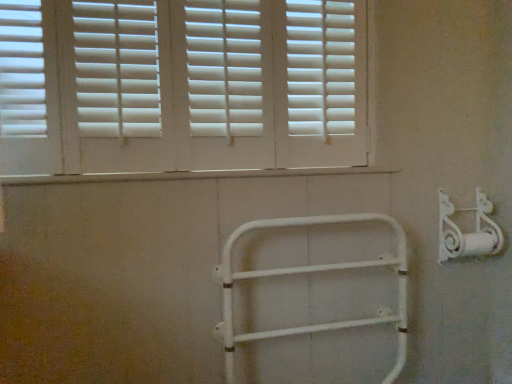
Find the location of a particular element. white matte shutters at upper center is located at coordinates (182, 86).

Consider the image. Can you confirm if white matte metal rail at center is smaller than white matte shutters at upper center?

Correct, white matte metal rail at center occupies less space than white matte shutters at upper center.

In the scene shown: Measure the distance between white matte metal rail at center and white matte shutters at upper center.

white matte metal rail at center and white matte shutters at upper center are 17.34 inches apart from each other.

From the image's perspective, is white matte metal rail at center on white matte shutters at upper center?

No.

In the scene shown: Is white matte shutters at upper center facing away from white matte bracket at right?

white matte shutters at upper center is not turned away from white matte bracket at right.

Is white matte shutters at upper center completely or partially outside of white matte bracket at right?

Yes, white matte shutters at upper center is located beyond the bounds of white matte bracket at right.

Which of these two, white matte shutters at upper center or white matte bracket at right, is bigger?

With larger size is white matte shutters at upper center.

From the image's perspective, which is below, white matte shutters at upper center or white matte bracket at right?

white matte bracket at right is shown below in the image.

Considering the positions of points (381, 319) and (503, 241), is point (381, 319) farther from camera compared to point (503, 241)?

That is False.

From the image's perspective, which one is positioned lower, white matte metal rail at center or white matte bracket at right?

white matte metal rail at center appears lower in the image.

From a real-world perspective, does white matte metal rail at center sit lower than white matte bracket at right?

Indeed, from a real-world perspective, white matte metal rail at center is positioned beneath white matte bracket at right.

Are white matte metal rail at center and white matte bracket at right making contact?

No.

From the picture: From a real-world perspective, is white matte bracket at right above or below white matte shutters at upper center?

In terms of real-world spatial position, white matte bracket at right is below white matte shutters at upper center.

Can you tell me how much white matte bracket at right and white matte shutters at upper center differ in facing direction?

0.132 degrees separate the facing orientations of white matte bracket at right and white matte shutters at upper center.

Could you tell me if white matte bracket at right is facing white matte shutters at upper center?

No, white matte bracket at right is not oriented towards white matte shutters at upper center.

From the image's perspective, is white matte bracket at right on top of white matte shutters at upper center?

Incorrect, from the image's perspective, white matte bracket at right is lower than white matte shutters at upper center.

Is white matte bracket at right aimed at white matte metal rail at center?

No, white matte bracket at right does not turn towards white matte metal rail at center.

Considering the positions of point (460, 254) and point (335, 219), is point (460, 254) closer or farther from the camera than point (335, 219)?

Clearly, point (460, 254) is more distant from the camera than point (335, 219).

Is there a large distance between white matte bracket at right and white matte metal rail at center?

No, white matte bracket at right is not far away from white matte metal rail at center.

Is white matte shutters at upper center far away from white matte metal rail at center?

That's not correct — white matte shutters at upper center is a little close to white matte metal rail at center.

Is white matte shutters at upper center spatially inside white matte metal rail at center, or outside of it?

white matte shutters at upper center is located beyond the bounds of white matte metal rail at center.

Which is in front, white matte shutters at upper center or white matte metal rail at center?

white matte shutters at upper center is in front.

Considering the sizes of objects white matte shutters at upper center and white matte metal rail at center in the image provided, who is smaller, white matte shutters at upper center or white matte metal rail at center?

With smaller size is white matte metal rail at center.

You are a GUI agent. You are given a task and a screenshot of the screen. Output one action in this format:
    pyautogui.click(x=<x>, y=<y>)
    Task: Click on the rail behind the white matte shutters at upper center
    
    Given the screenshot: What is the action you would take?
    pyautogui.click(x=313, y=272)

At what (x,y) coordinates should I click in order to perform the action: click on metal directly beneath the white matte shutters at upper center (from a real-world perspective). Please return your answer as a coordinate pair (x, y). This screenshot has width=512, height=384. Looking at the image, I should click on (468, 233).

From the image, which object appears to be farther from white matte shutters at upper center, white matte bracket at right or white matte metal rail at center?

white matte bracket at right is further to white matte shutters at upper center.

Estimate the real-world distances between objects in this image. Which object is closer to white matte shutters at upper center, white matte metal rail at center or white matte bracket at right?

The object closer to white matte shutters at upper center is white matte metal rail at center.

When comparing their distances from white matte bracket at right, does white matte metal rail at center or white matte shutters at upper center seem closer?

Based on the image, white matte metal rail at center appears to be nearer to white matte bracket at right.

From the image, which object appears to be farther from white matte metal rail at center, white matte bracket at right or white matte shutters at upper center?

white matte shutters at upper center is further to white matte metal rail at center.

When comparing their distances from white matte metal rail at center, does white matte shutters at upper center or white matte bracket at right seem closer?

white matte bracket at right is closer to white matte metal rail at center.

Estimate the real-world distances between objects in this image. Which object is closer to white matte bracket at right, white matte shutters at upper center or white matte metal rail at center?

white matte metal rail at center is positioned closer to the anchor white matte bracket at right.

At what (x,y) coordinates should I click in order to perform the action: click on rail between white matte shutters at upper center and white matte bracket at right in the horizontal direction. Please return your answer as a coordinate pair (x, y). Looking at the image, I should click on 313,272.